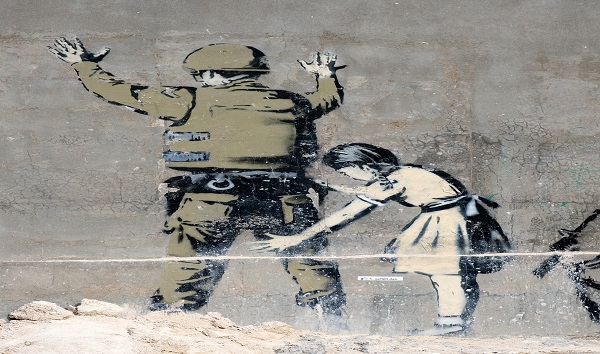
Locate an element on the screen. oily stains on wall is located at coordinates (433, 156), (543, 146), (588, 68).